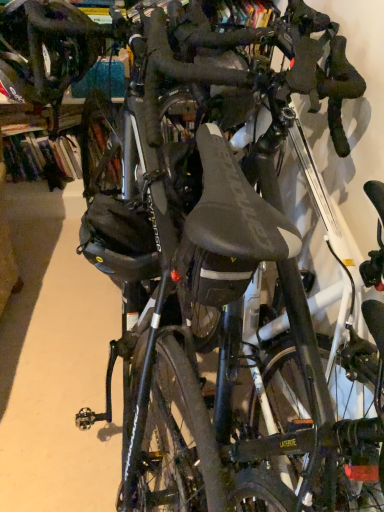
The width and height of the screenshot is (384, 512). Describe the element at coordinates (45, 48) in the screenshot. I see `matte black helmet at upper left` at that location.

This screenshot has height=512, width=384. In order to click on matte black helmet at upper left in this screenshot , I will do `click(45, 48)`.

The image size is (384, 512). Identify the location of matte black helmet at upper left. [x=45, y=48].